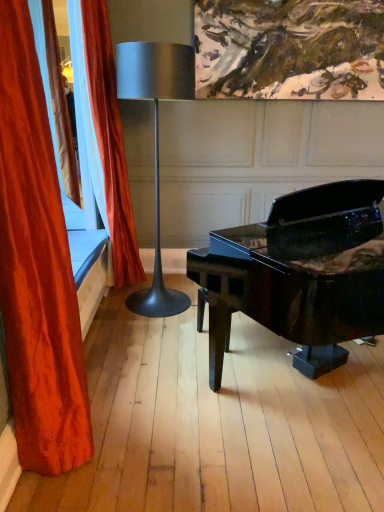
This screenshot has height=512, width=384. Identify the location of free space on the front side of velvet orange curtain at left, positioned as the 1th curtain in back-to-front order. (125, 318).